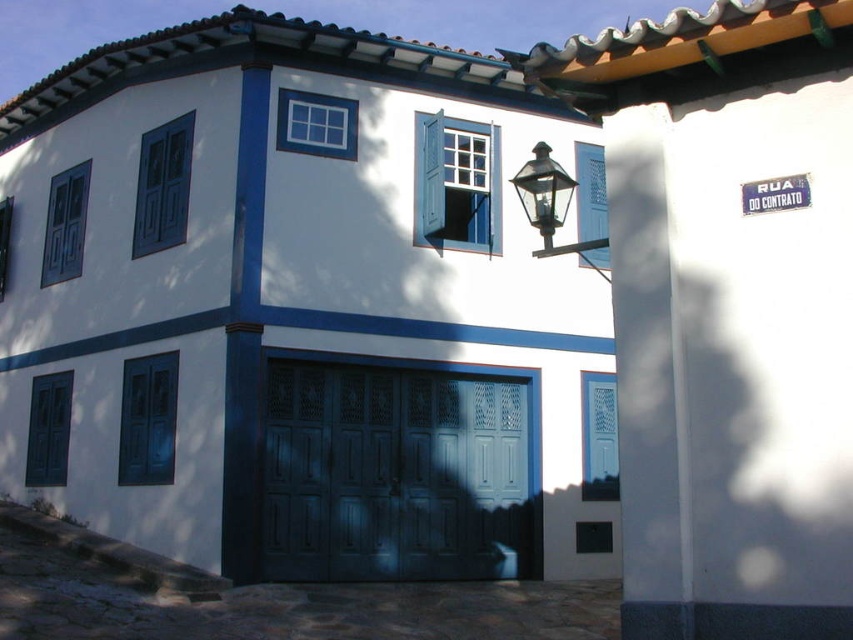
Question: Which of the following is the farthest from the observer?

Choices:
 (A) (492, 225)
 (B) (161, 198)
 (C) (593, 163)

Answer: (C)

Question: Which point appears farthest from the camera in this image?

Choices:
 (A) (456, 474)
 (B) (173, 420)
 (C) (492, 212)
 (D) (51, 208)

Answer: (D)

Question: Which point is closer to the camera?

Choices:
 (A) blue painted wood shutter at upper left
 (B) blue matte door at lower left
 (C) white wooden shutter at center

Answer: (B)

Question: Is blue matte door at lower left further to the viewer compared to blue painted wood shutter at lower left?

Choices:
 (A) no
 (B) yes

Answer: (A)

Question: Does dark wood/glass garage door at center appear on the left side of blue matte shutter at left?

Choices:
 (A) no
 (B) yes

Answer: (A)

Question: Is blue painted wood shutter at upper center positioned behind white wooden shutter at center?

Choices:
 (A) yes
 (B) no

Answer: (B)